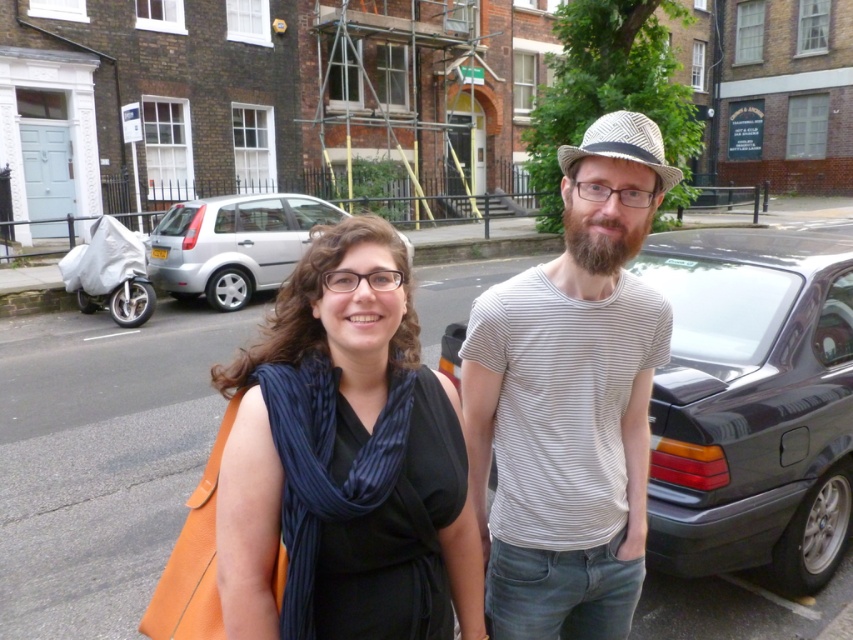
Question: Is the position of dark gray metallic car at right more distant than that of black silk scarf at center?

Choices:
 (A) yes
 (B) no

Answer: (A)

Question: Among these points, which one is farthest from the camera?

Choices:
 (A) (381, 636)
 (B) (659, 541)

Answer: (B)

Question: Which of the following is the farthest from the observer?

Choices:
 (A) (389, 557)
 (B) (469, 346)
 (C) (844, 232)

Answer: (C)

Question: Is striped cotton t-shirt at center above black silk scarf at center?

Choices:
 (A) yes
 (B) no

Answer: (A)

Question: Is striped cotton t-shirt at center to the right of silver metallic hatchback at center-left from the viewer's perspective?

Choices:
 (A) no
 (B) yes

Answer: (B)

Question: Among these objects, which one is farthest from the camera?

Choices:
 (A) striped cotton t-shirt at center
 (B) silver metallic hatchback at center-left

Answer: (B)